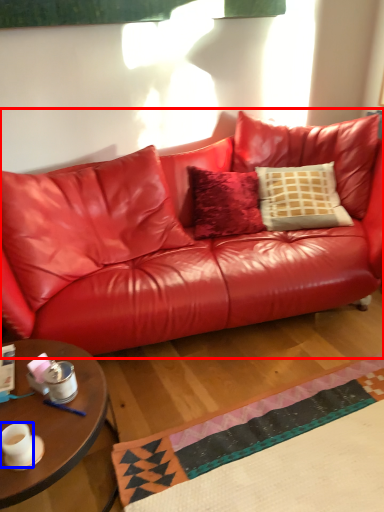
Question: Which point is further to the camera, studio couch (highlighted by a red box) or coffee cup (highlighted by a blue box)?

Choices:
 (A) studio couch
 (B) coffee cup

Answer: (A)